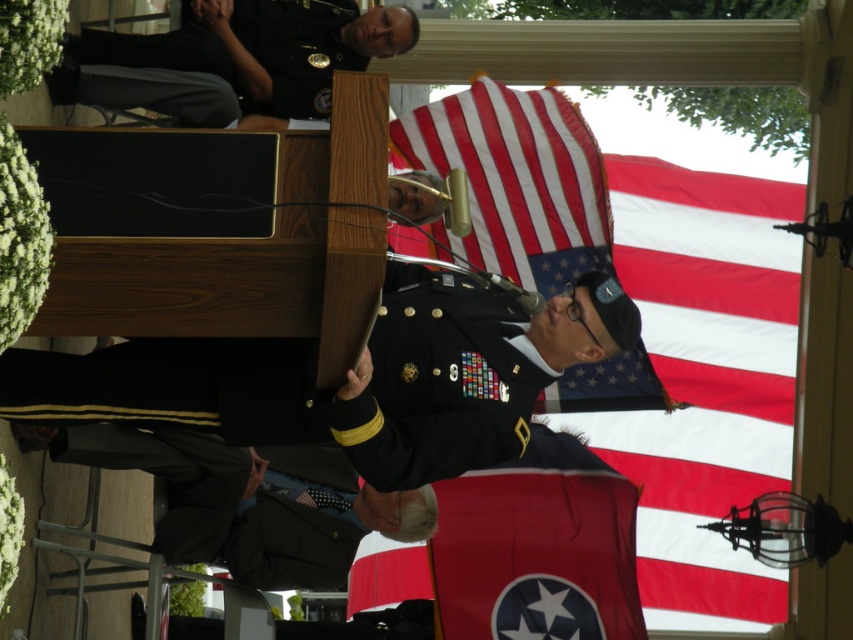
Who is positioned more to the left, red/white striped fabric at center or dark gray suit at lower left?

dark gray suit at lower left is more to the left.

Is red/white striped fabric at center further to the viewer compared to dark gray suit at lower left?

Yes, it is.

Is point (585, 243) closer to camera compared to point (241, 554)?

No, it is not.

The height and width of the screenshot is (640, 853). I want to click on red/white striped fabric at center, so click(x=515, y=180).

Is the position of red fabric flag at center less distant than that of dark gray suit at lower left?

No, it is not.

Is red fabric flag at center shorter than dark gray suit at lower left?

Incorrect, red fabric flag at center's height does not fall short of dark gray suit at lower left's.

Is point (485, 538) positioned in front of point (401, 508)?

No, it is not.

This screenshot has height=640, width=853. I want to click on red fabric flag at center, so click(521, 550).

Does point (80, 368) come behind point (569, 385)?

No, it is not.

In the scene shown: Measure the distance between shiny black uniform at center and camera.

shiny black uniform at center and camera are 30.07 meters apart from each other.

Who is more forward, (512,365) or (599,182)?

Point (512,365)

Where is `shiny black uniform at center`? This screenshot has height=640, width=853. shiny black uniform at center is located at coordinates (308, 387).